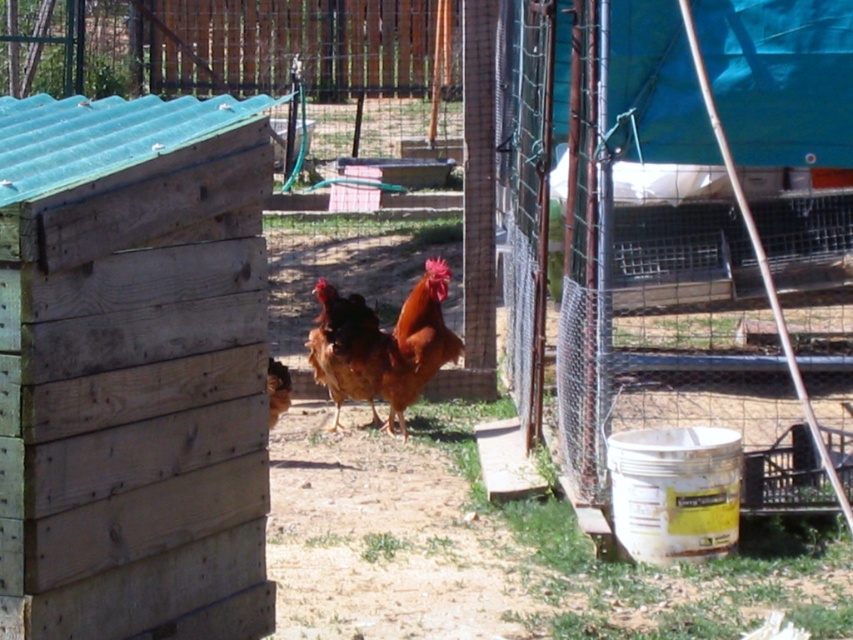
Can you confirm if brown feathered rooster at center is positioned below brown feathered chicken at center?

Incorrect, brown feathered rooster at center is not positioned below brown feathered chicken at center.

Which is in front, point (351, 344) or point (281, 404)?

Positioned in front is point (281, 404).

This screenshot has height=640, width=853. What do you see at coordinates (345, 349) in the screenshot?
I see `brown feathered rooster at center` at bounding box center [345, 349].

Locate an element on the screen. The width and height of the screenshot is (853, 640). brown feathered rooster at center is located at coordinates (345, 349).

Is point (358, 358) positioned before point (374, 358)?

Yes, point (358, 358) is closer to viewer.

Does brown matte chicken at center appear under brown feathered rooster at center?

Yes, brown matte chicken at center is below brown feathered rooster at center.

Where is `brown matte chicken at center`? The height and width of the screenshot is (640, 853). brown matte chicken at center is located at coordinates [x=392, y=339].

Is brown matte chicken at center in front of brown feathered chicken at center?

No, brown matte chicken at center is behind brown feathered chicken at center.

Is brown matte chicken at center bigger than brown feathered chicken at center?

Indeed, brown matte chicken at center has a larger size compared to brown feathered chicken at center.

Measure the distance between point (x=439, y=266) and camera.

A distance of 30.54 feet exists between point (x=439, y=266) and camera.

Where is `brown matte chicken at center`? This screenshot has height=640, width=853. brown matte chicken at center is located at coordinates (392, 339).